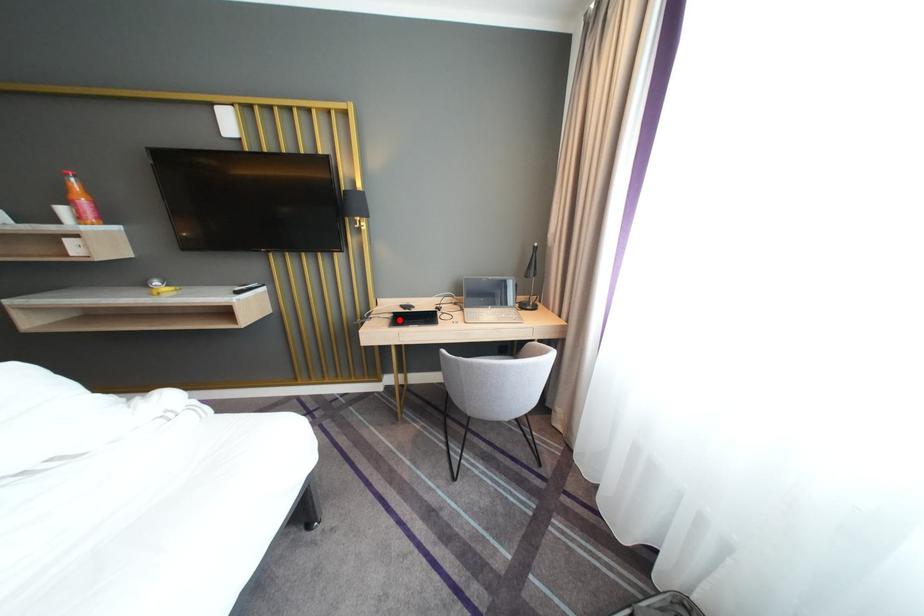
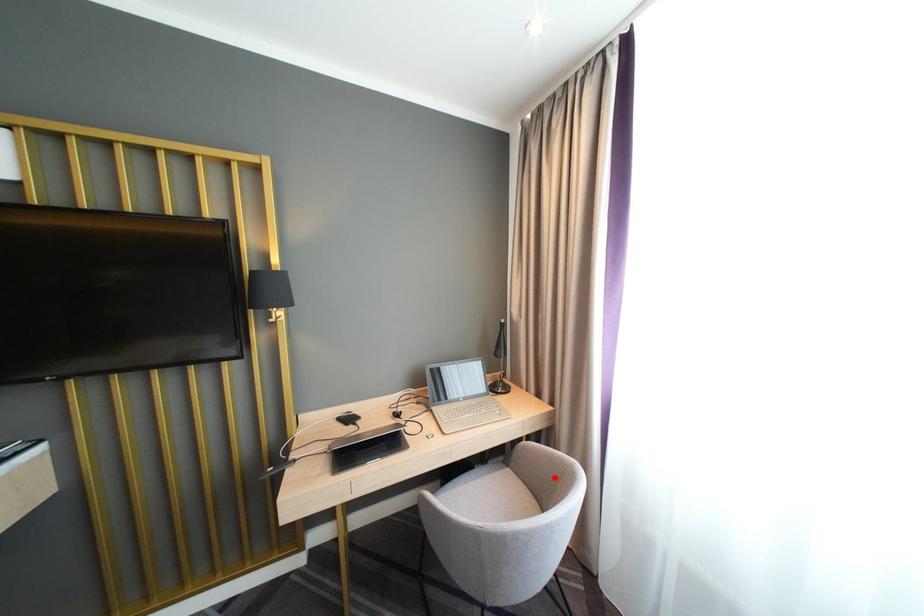
From the picture: I am providing you with two images of the same scene from different viewpoints. A red point is marked on the first image and another point is marked on the second image. Is the red point in image1 aligned with the point shown in image2?

No